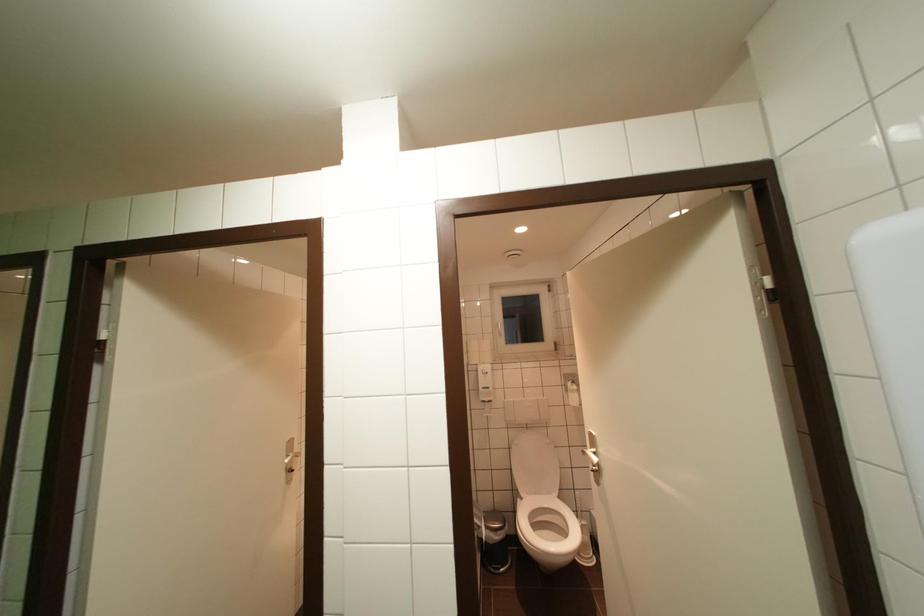
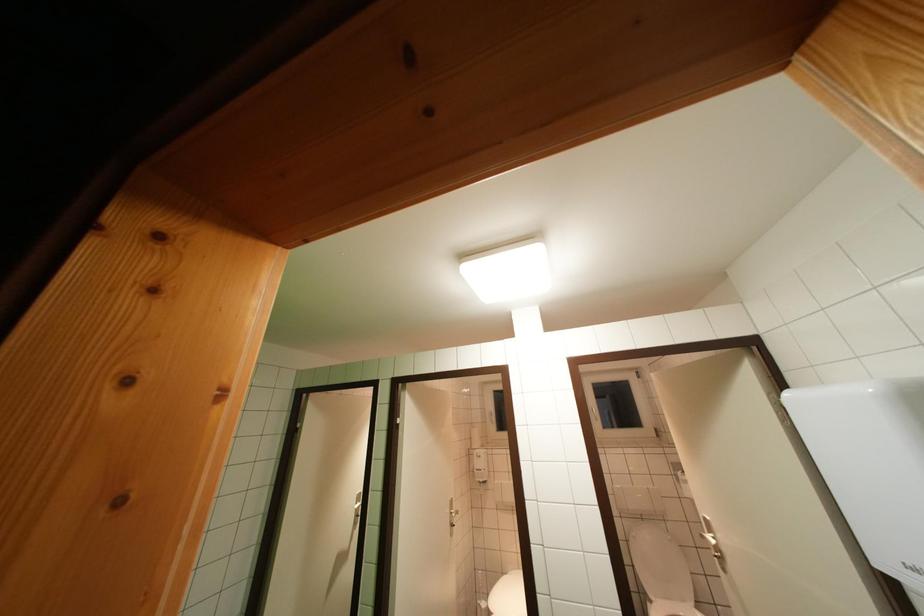
Question: What movement of the cameraman would produce the second image?

Choices:
 (A) Left
 (B) Right
 (C) Forward
 (D) Backward

Answer: (D)